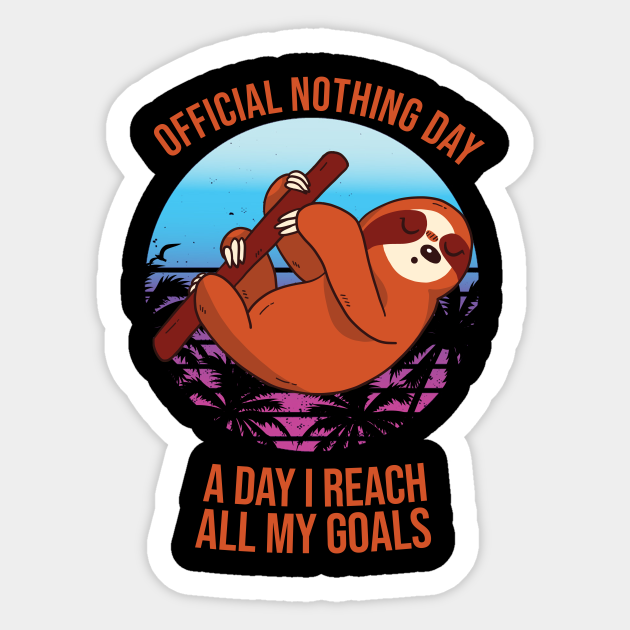
What are the coordinates of `sticker` in the screenshot? It's located at (294, 290).